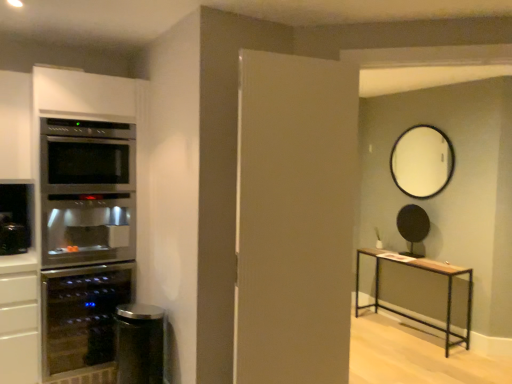
Locate an element on the screen. The height and width of the screenshot is (384, 512). free spot above white matte door at center (from a real-world perspective) is located at coordinates pos(305,58).